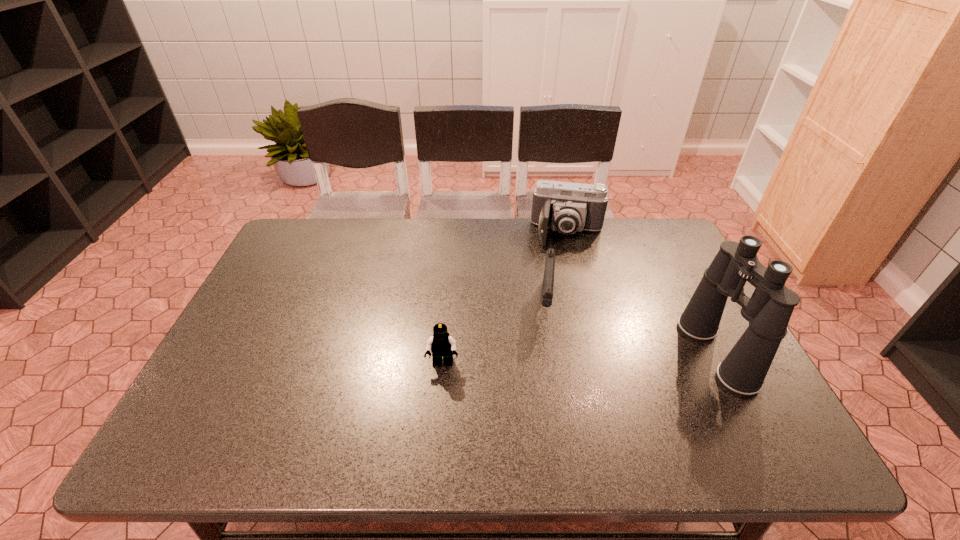
The height and width of the screenshot is (540, 960). Identify the location of Lego. (441, 344).

Identify the location of binoculars. (768, 311).

The width and height of the screenshot is (960, 540). In order to click on the rightmost object in this screenshot , I will do `click(768, 311)`.

Image resolution: width=960 pixels, height=540 pixels. In order to click on the farthest object in this screenshot , I will do `click(567, 207)`.

Locate an element on the screen. This screenshot has width=960, height=540. camera is located at coordinates click(567, 207).

At what (x,y) coordinates should I click in order to perform the action: click on pistol. Please return your answer as a coordinate pair (x, y). Image resolution: width=960 pixels, height=540 pixels. Looking at the image, I should click on click(548, 280).

Where is `vacant space located on the front-facing side of the Lego`? This screenshot has height=540, width=960. vacant space located on the front-facing side of the Lego is located at coordinates (441, 389).

This screenshot has height=540, width=960. I want to click on vacant space situated 0.320m on the left of the binoculars, so pos(561,353).

Where is `vacant space positioned 0.130m at the front of the second tallest object with an open lens cover`? The width and height of the screenshot is (960, 540). vacant space positioned 0.130m at the front of the second tallest object with an open lens cover is located at coordinates (563, 275).

This screenshot has height=540, width=960. I want to click on free spot located 0.130m at the front of the second tallest object with an open lens cover, so click(x=563, y=275).